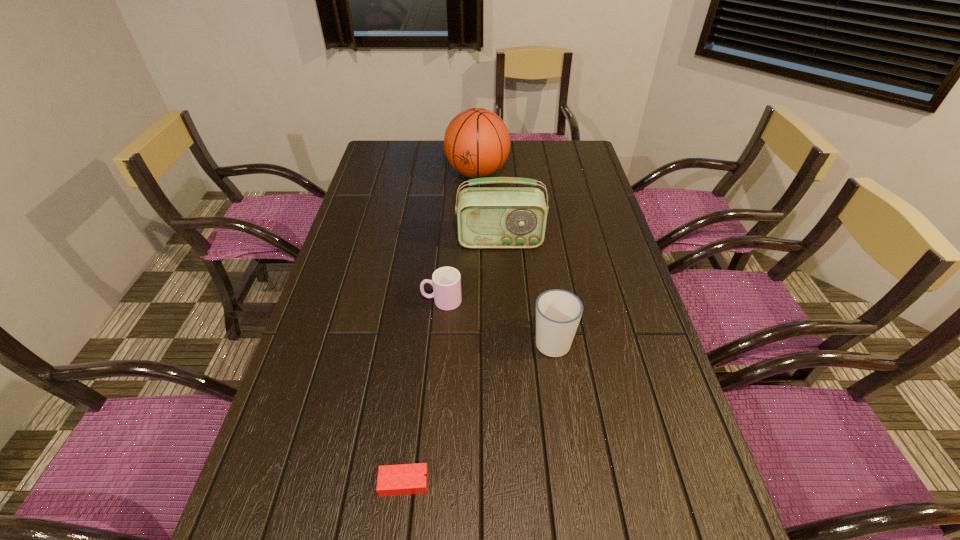
Image resolution: width=960 pixels, height=540 pixels. I want to click on basketball, so click(477, 143).

You are a GUI agent. You are given a task and a screenshot of the screen. Output one action in this format:
    pyautogui.click(x=<x>, y=<y>)
    Task: Click on the radio receiver
    
    Given the screenshot: What is the action you would take?
    pyautogui.click(x=487, y=217)

The width and height of the screenshot is (960, 540). What are the coordinates of `the nearer cup` in the screenshot? It's located at (558, 312).

This screenshot has height=540, width=960. I want to click on the second nearest object, so click(558, 312).

In order to click on the farther cup in this screenshot , I will do `click(446, 281)`.

Locate an element on the screen. the shorter cup is located at coordinates (446, 281).

You are a GUI agent. You are given a task and a screenshot of the screen. Output one action in this format:
    pyautogui.click(x=<x>, y=<y>)
    Task: Click on the shortest object
    
    Given the screenshot: What is the action you would take?
    pyautogui.click(x=404, y=479)

Identify the location of the nearest object. The width and height of the screenshot is (960, 540). coord(404,479).

You are a GUI agent. You are given a task and a screenshot of the screen. Output one action in this format:
    pyautogui.click(x=<x>, y=<y>)
    Task: Click on the vacant space located on the front of the farthest object
    The image size is (960, 540).
    Given the screenshot: What is the action you would take?
    pyautogui.click(x=477, y=232)

Locate an element on the screen. The height and width of the screenshot is (540, 960). vacant region located 0.180m on the front panel of the radio receiver is located at coordinates (503, 293).